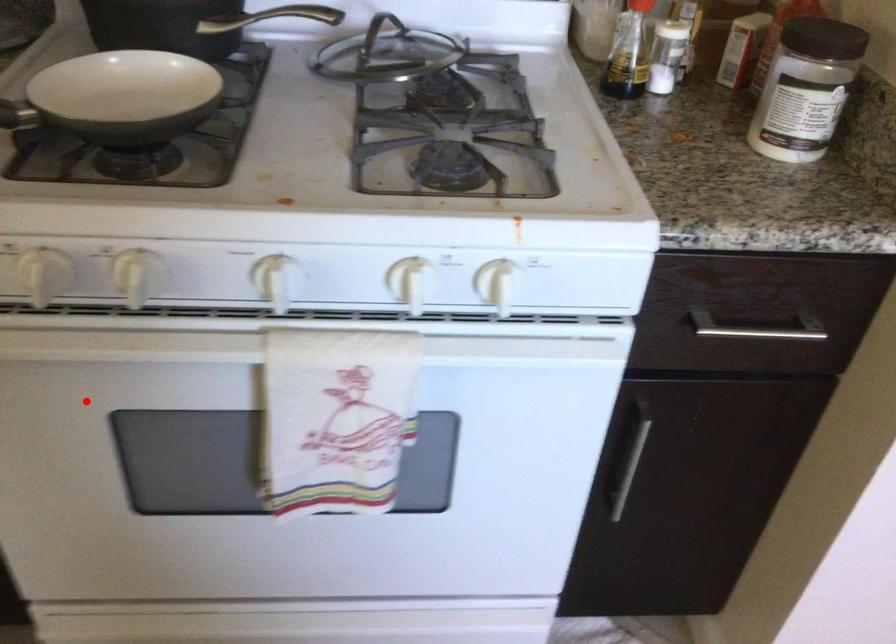
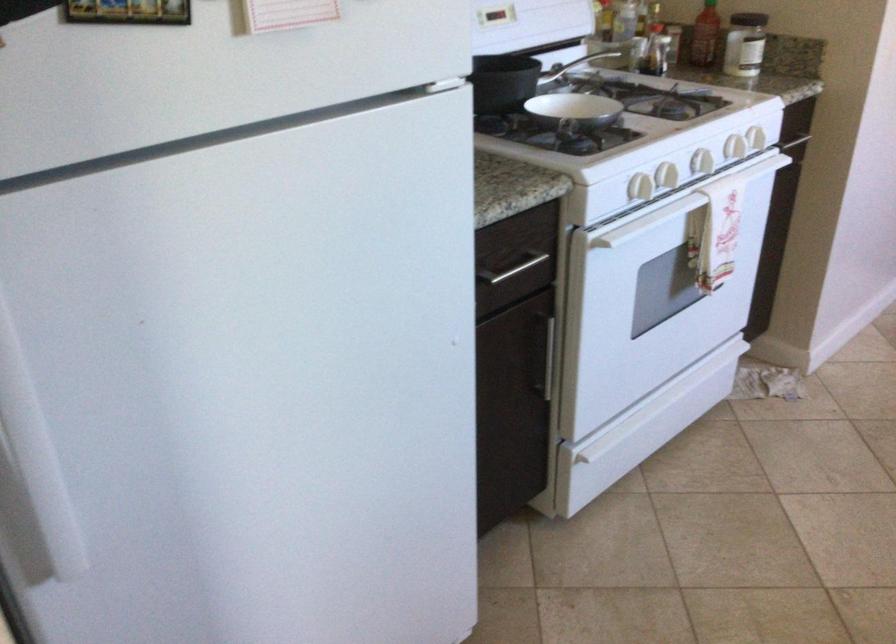
Locate, in the second image, the point that corresponds to the highlighted location in the first image.

(679, 205)